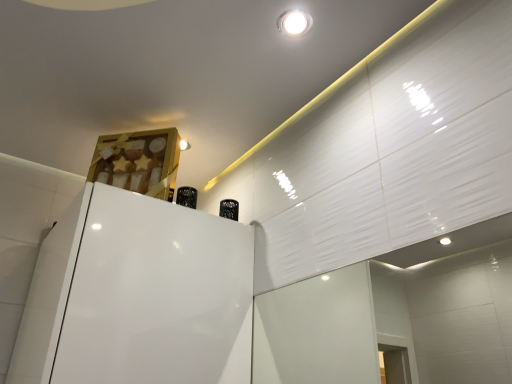
Locate an element on the screen. This screenshot has width=512, height=384. free space above gold foil box at upper left (from a real-world perspective) is located at coordinates (135, 125).